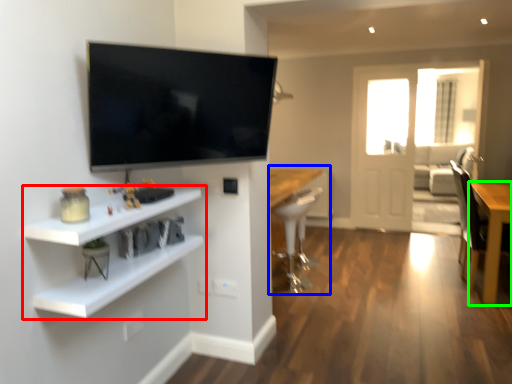
Question: Estimate the real-world distances between objects in this image. Which object is closer to shelf (highlighted by a red box), computer desk (highlighted by a blue box) or table (highlighted by a green box)?

Choices:
 (A) computer desk
 (B) table

Answer: (A)